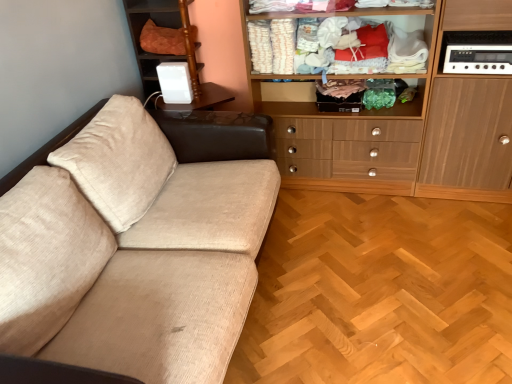
Question: Which is correct: wooden cabinet at upper right, the second cabinetry viewed from the right, is inside white plastic device at upper right, the second appliance viewed from the right, or outside of it?

Choices:
 (A) outside
 (B) inside

Answer: (A)

Question: In the image, is wooden cabinet at upper right, the second cabinetry viewed from the right, positioned in front of or behind white plastic device at upper right, which is the first appliance in left-to-right order?

Choices:
 (A) behind
 (B) front

Answer: (B)

Question: Which object is the closest to the white plastic stereo at upper right, the 2th appliance positioned from the back?

Choices:
 (A) orange quilted cushion at upper left
 (B) white plastic device at upper right, which appears as the 1th appliance when viewed from the back
 (C) wooden cabinet at upper right, the second cabinetry viewed from the right
 (D) light brown wood cabinet at right, placed as the second cabinetry when sorted from left to right

Answer: (D)

Question: Which object is positioned farthest from the wooden cabinet at upper right, the second cabinetry viewed from the right?

Choices:
 (A) white plastic stereo at upper right, marked as the second appliance in a left-to-right arrangement
 (B) light brown wood cabinet at right, placed as the second cabinetry when sorted from left to right
 (C) white plastic device at upper right, which appears as the 1th appliance when viewed from the back
 (D) orange quilted cushion at upper left

Answer: (D)